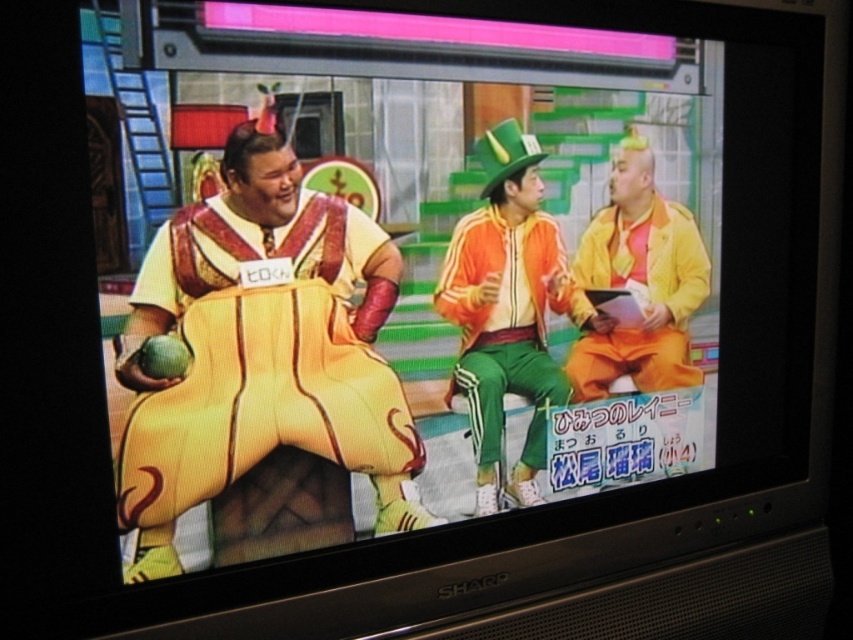
Is orange velour tracksuit at center taller than matte yellow jacket at right?

Correct, orange velour tracksuit at center is much taller as matte yellow jacket at right.

Is point (544, 416) positioned in front of point (648, 220)?

That is True.

At what (x,y) coordinates should I click in order to perform the action: click on orange velour tracksuit at center. Please return your answer as a coordinate pair (x, y). Looking at the image, I should click on (503, 323).

Is yellow fabric costume at left above matte yellow jacket at right?

Actually, yellow fabric costume at left is below matte yellow jacket at right.

Does point (231, 392) lie behind point (641, 355)?

That is False.

The image size is (853, 640). Describe the element at coordinates (265, 362) in the screenshot. I see `yellow fabric costume at left` at that location.

At what (x,y) coordinates should I click in order to perform the action: click on yellow fabric costume at left. Please return your answer as a coordinate pair (x, y). This screenshot has height=640, width=853. Looking at the image, I should click on (265, 362).

Identify the location of yellow fabric costume at left. (265, 362).

Is point (308, 300) less distant than point (440, 310)?

Yes, it is in front of point (440, 310).

I want to click on yellow fabric costume at left, so click(x=265, y=362).